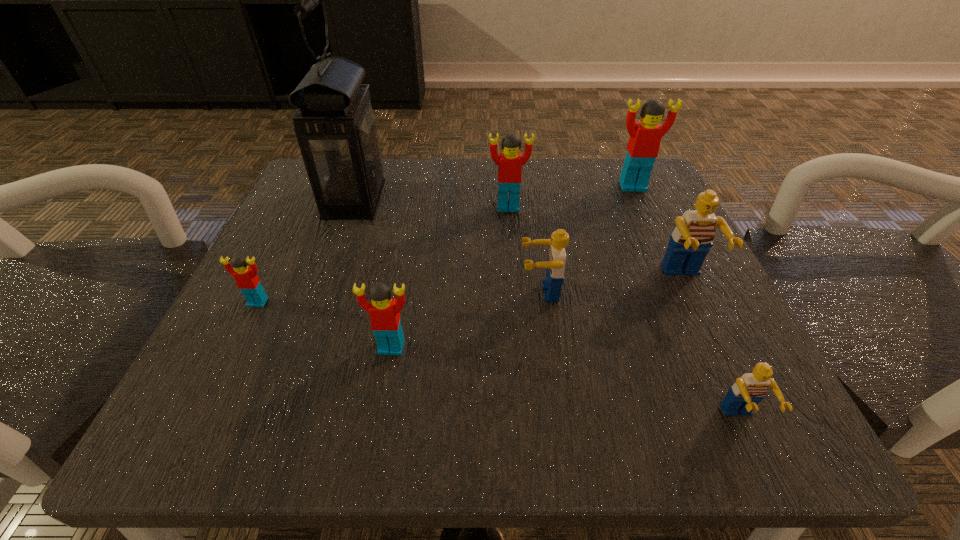
Find the location of `the leftmost Lego`. the leftmost Lego is located at coordinates (247, 280).

The image size is (960, 540). In order to click on the third farthest red Lego in this screenshot , I will do `click(247, 280)`.

At what (x,y) coordinates should I click in order to perform the action: click on the nearest blue Lego. Please return your answer as a coordinate pair (x, y). The width and height of the screenshot is (960, 540). Looking at the image, I should click on (748, 390).

Identify the location of the nearest Lego. (748, 390).

Find the location of `vacant space located 0.370m on the front-facing side of the seventh object from right to left`. vacant space located 0.370m on the front-facing side of the seventh object from right to left is located at coordinates (571, 200).

Identify the location of vacant space situated 0.310m on the face of the tallest Lego. (686, 305).

The width and height of the screenshot is (960, 540). I want to click on free spot located on the face of the third red Lego from left to right, so click(513, 269).

This screenshot has height=540, width=960. In order to click on vacant space located on the face of the biggest blue Lego in this screenshot , I will do [735, 386].

Where is `vacant space situated on the face of the second nearest Lego`? Image resolution: width=960 pixels, height=540 pixels. vacant space situated on the face of the second nearest Lego is located at coordinates (383, 394).

You are a GUI agent. You are given a task and a screenshot of the screen. Output one action in this format:
    pyautogui.click(x=<x>, y=<y>)
    Task: Click on the free location located 0.230m on the face of the leftmost blue Lego
    This screenshot has width=960, height=540.
    Given the screenshot: What is the action you would take?
    pyautogui.click(x=374, y=292)